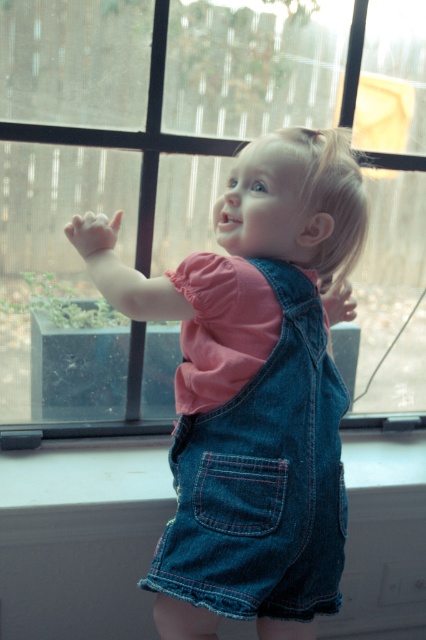
Question: Does clear glass window at center have a greater width compared to denim overalls at center?

Choices:
 (A) yes
 (B) no

Answer: (A)

Question: Can you confirm if clear glass window at center is positioned below denim jacket at center?

Choices:
 (A) yes
 (B) no

Answer: (B)

Question: Which object appears farthest from the camera in this image?

Choices:
 (A) denim overalls at center
 (B) clear glass window at center

Answer: (B)

Question: Does clear glass window at center appear on the left side of denim overalls at center?

Choices:
 (A) yes
 (B) no

Answer: (B)

Question: Which of the following is the closest to the observer?

Choices:
 (A) clear glass window at center
 (B) denim overalls at center
 (C) denim jacket at center

Answer: (C)

Question: Which is farther from the denim overalls at center?

Choices:
 (A) clear glass window at center
 (B) denim jacket at center

Answer: (A)